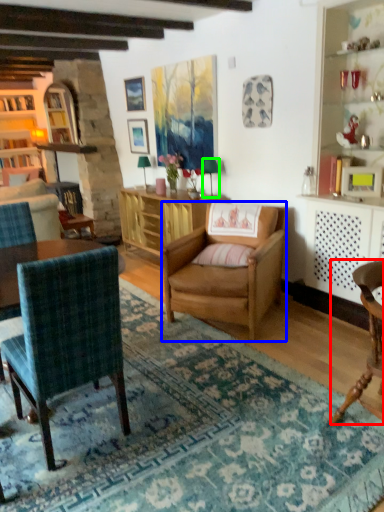
Question: Based on their relative distances, which object is nearer to chair (highlighted by a red box)? Choose from chair (highlighted by a blue box) and lamp (highlighted by a green box).

Choices:
 (A) chair
 (B) lamp

Answer: (A)